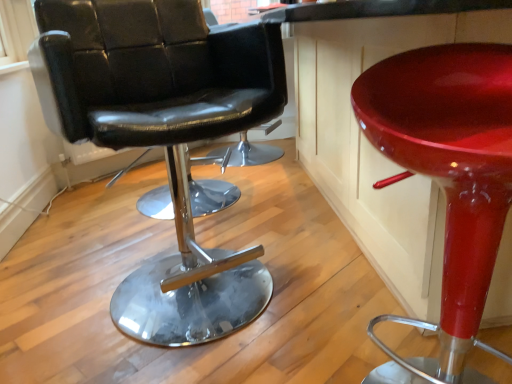
Question: In the image, is glossy red stool at right positioned in front of or behind black leather chair at left?

Choices:
 (A) behind
 (B) front

Answer: (B)

Question: Is glossy red stool at right to the left or to the right of black leather chair at left in the image?

Choices:
 (A) left
 (B) right

Answer: (B)

Question: Looking at their shapes, would you say glossy red stool at right is wider or thinner than black leather chair at left?

Choices:
 (A) thin
 (B) wide

Answer: (A)

Question: Considering the relative positions of black leather chair at left and glossy red stool at right in the image provided, is black leather chair at left to the left or to the right of glossy red stool at right?

Choices:
 (A) left
 (B) right

Answer: (A)

Question: Looking at their shapes, would you say black leather chair at left is wider or thinner than glossy red stool at right?

Choices:
 (A) thin
 (B) wide

Answer: (B)

Question: Considering the positions of point (176, 160) and point (430, 56), is point (176, 160) closer or farther from the camera than point (430, 56)?

Choices:
 (A) closer
 (B) farther

Answer: (B)

Question: From the image's perspective, is black leather chair at left located above or below glossy red stool at right?

Choices:
 (A) above
 (B) below

Answer: (A)